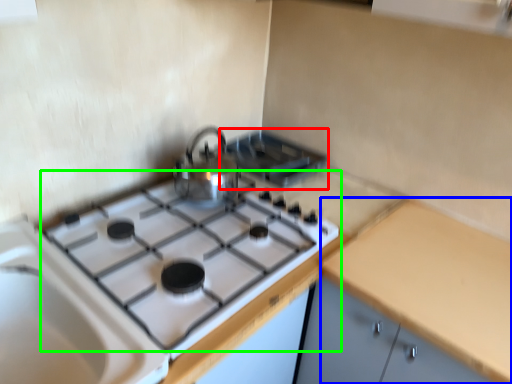
Question: Estimate the real-world distances between objects in this image. Which object is closer to appliance (highlighted by a red box), counter top (highlighted by a blue box) or gas stove (highlighted by a green box)?

Choices:
 (A) counter top
 (B) gas stove

Answer: (B)